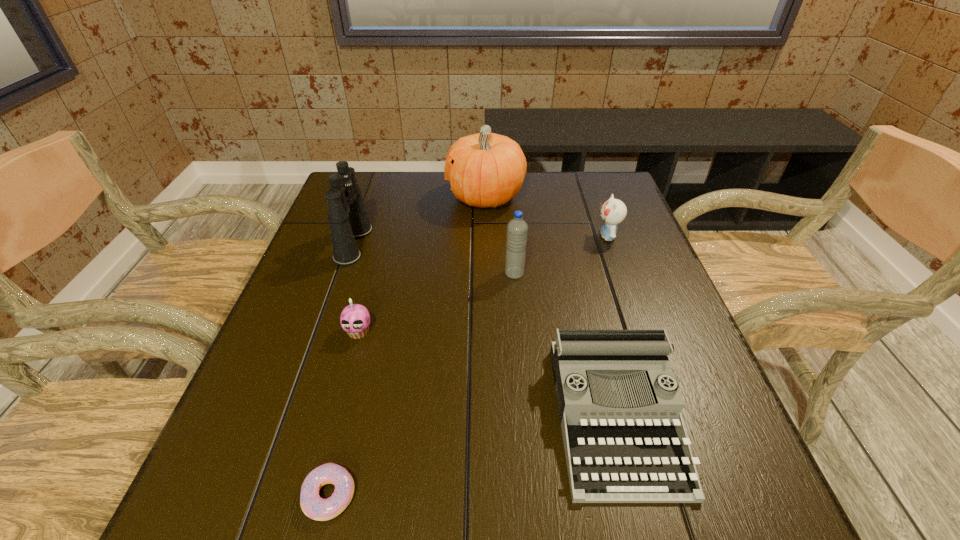
Locate an element on the screen. This screenshot has height=540, width=960. pumpkin is located at coordinates pyautogui.click(x=485, y=169).

Where is `binoculars`? The width and height of the screenshot is (960, 540). binoculars is located at coordinates (347, 215).

Where is `the fifth shortest object`? This screenshot has height=540, width=960. the fifth shortest object is located at coordinates (517, 229).

You are a GUI agent. You are given a task and a screenshot of the screen. Output one action in this format:
    pyautogui.click(x=<x>, y=<y>)
    Task: Click on the fourth nearest object
    The image size is (960, 540).
    Given the screenshot: What is the action you would take?
    pyautogui.click(x=517, y=229)

You are a GUI agent. You are given a task and a screenshot of the screen. Output one action in this format:
    pyautogui.click(x=<x>, y=<y>)
    Task: Click on the kitten
    
    Given the screenshot: What is the action you would take?
    pos(613,211)

Identify the location of cupcake. This screenshot has height=540, width=960. (355, 319).

Where is `typewriter`? The image size is (960, 540). typewriter is located at coordinates (620, 406).

Locate an element on the screen. The width and height of the screenshot is (960, 540). the shortest object is located at coordinates (313, 506).

This screenshot has width=960, height=540. In order to click on free location located on the front-facing side of the pumpkin in this screenshot , I will do `click(366, 197)`.

Where is `vacant space located 0.090m on the front-facing side of the pumpkin`? The width and height of the screenshot is (960, 540). vacant space located 0.090m on the front-facing side of the pumpkin is located at coordinates (417, 197).